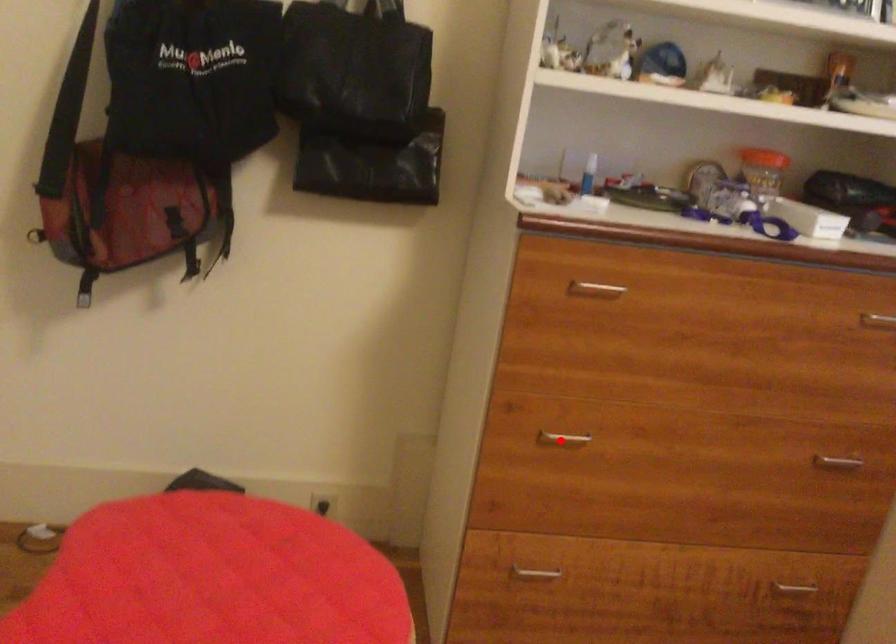
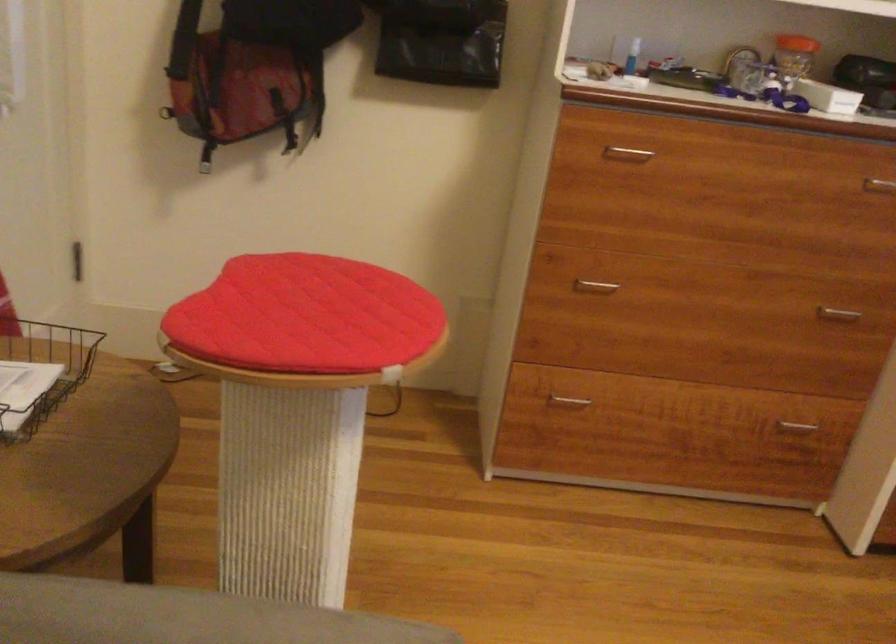
The point at the highlighted location is marked in the first image. Where is the corresponding point in the second image?

(595, 286)